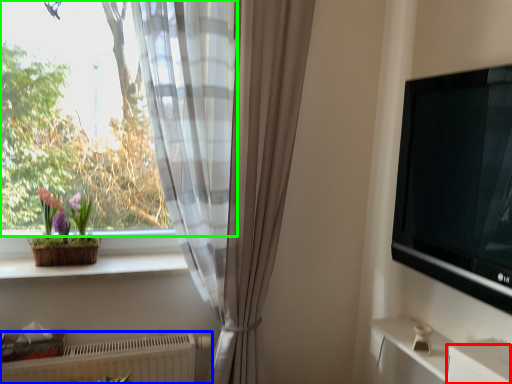
Question: Which object is positioned closest to drawer (highlighted by a red box)? Select from radiator (highlighted by a blue box) and window (highlighted by a green box).

Choices:
 (A) radiator
 (B) window

Answer: (A)